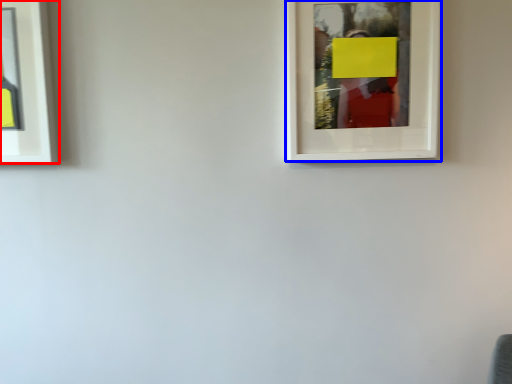
Question: Among these objects, which one is nearest to the camera, picture frame (highlighted by a red box) or picture frame (highlighted by a blue box)?

Choices:
 (A) picture frame
 (B) picture frame

Answer: (B)